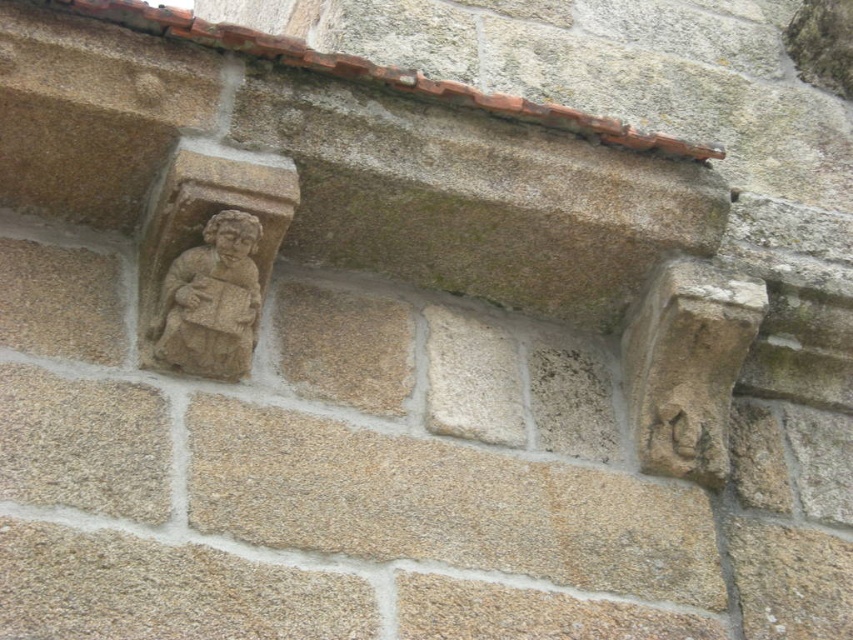
Question: Which object appears farthest from the camera in this image?

Choices:
 (A) beige stone figure at upper left
 (B) carved stone face at upper left

Answer: (B)

Question: Can you confirm if beige stone figure at upper left is positioned above carved stone face at upper left?

Choices:
 (A) yes
 (B) no

Answer: (B)

Question: Does beige stone figure at upper left lie in front of carved stone face at upper left?

Choices:
 (A) no
 (B) yes

Answer: (B)

Question: Does beige stone figure at upper left have a greater width compared to carved stone face at upper left?

Choices:
 (A) no
 (B) yes

Answer: (B)